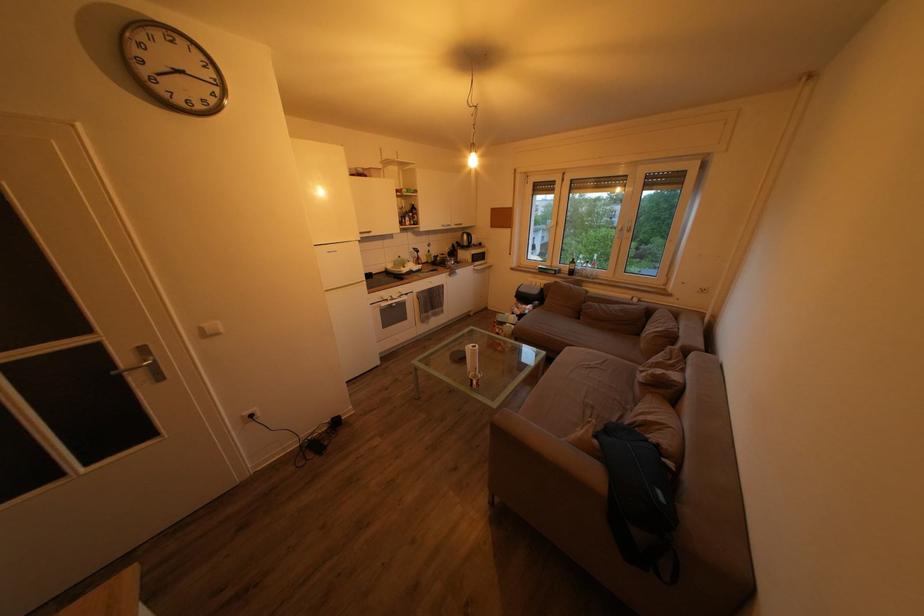
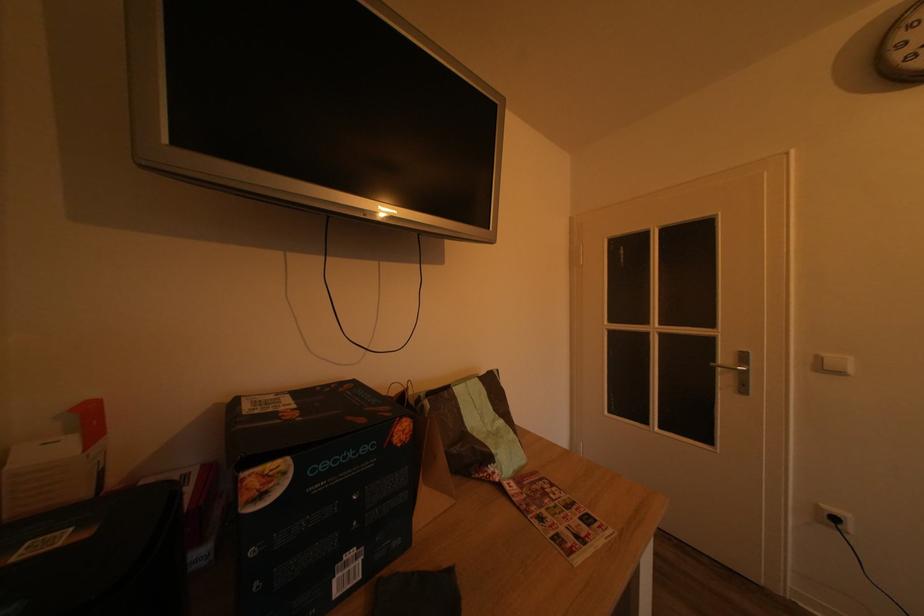
Find the pixel in the second image that matches point 123,373 in the first image.

(723, 368)